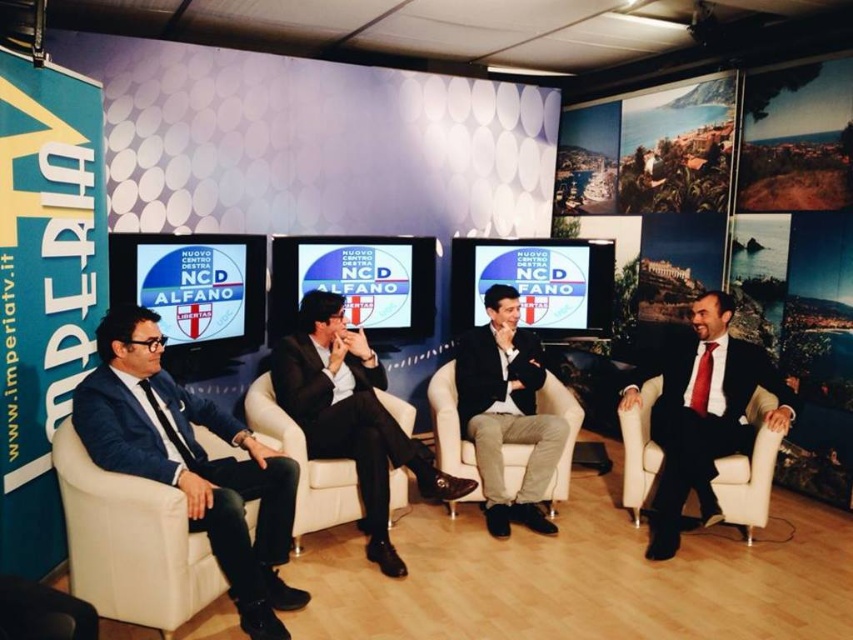
Question: Which of the following is the farthest from the observer?

Choices:
 (A) pyautogui.click(x=314, y=378)
 (B) pyautogui.click(x=553, y=460)
 (C) pyautogui.click(x=701, y=403)
 (D) pyautogui.click(x=166, y=413)

Answer: (C)

Question: Which point is closer to the camera?

Choices:
 (A) dark blue fabric suit at center
 (B) matte black suit at center
 (C) matte black suit at left
 (D) matte black suit at right

Answer: (C)

Question: Is matte black suit at left thinner than matte black suit at center?

Choices:
 (A) no
 (B) yes

Answer: (A)

Question: Where is matte black suit at left located in relation to matte black suit at right in the image?

Choices:
 (A) right
 (B) left

Answer: (B)

Question: Which object appears closest to the camera in this image?

Choices:
 (A) matte black suit at left
 (B) dark blue fabric suit at center
 (C) matte black suit at right
 (D) matte black suit at center

Answer: (A)

Question: Is matte black suit at right wider than matte black suit at center?

Choices:
 (A) no
 (B) yes

Answer: (B)